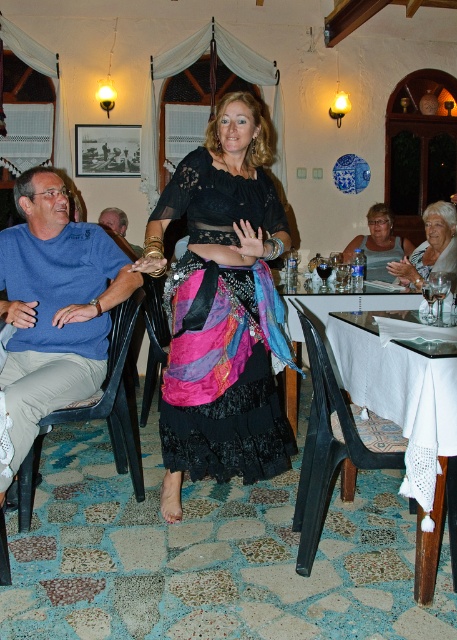
Question: Is black plastic chair at lower center to the left of pink satin dress at center from the viewer's perspective?

Choices:
 (A) yes
 (B) no

Answer: (A)

Question: Among these points, which one is farthest from the camera?

Choices:
 (A) (115, 227)
 (B) (441, 243)

Answer: (A)

Question: Among these objects, which one is farthest from the camera?

Choices:
 (A) matte gray tank top at center
 (B) black plastic chair at lower center

Answer: (A)

Question: Does black plastic chair at lower center appear over matte black dress at center?

Choices:
 (A) yes
 (B) no

Answer: (B)

Question: Observing the image, what is the correct spatial positioning of white cloth-covered table at center in reference to blue cotton shirt at left?

Choices:
 (A) right
 (B) left

Answer: (A)

Question: Estimate the real-world distances between objects in this image. Which object is farther from the matte gray tank top at center?

Choices:
 (A) pink satin dress at center
 (B) black plastic chair at lower center

Answer: (B)